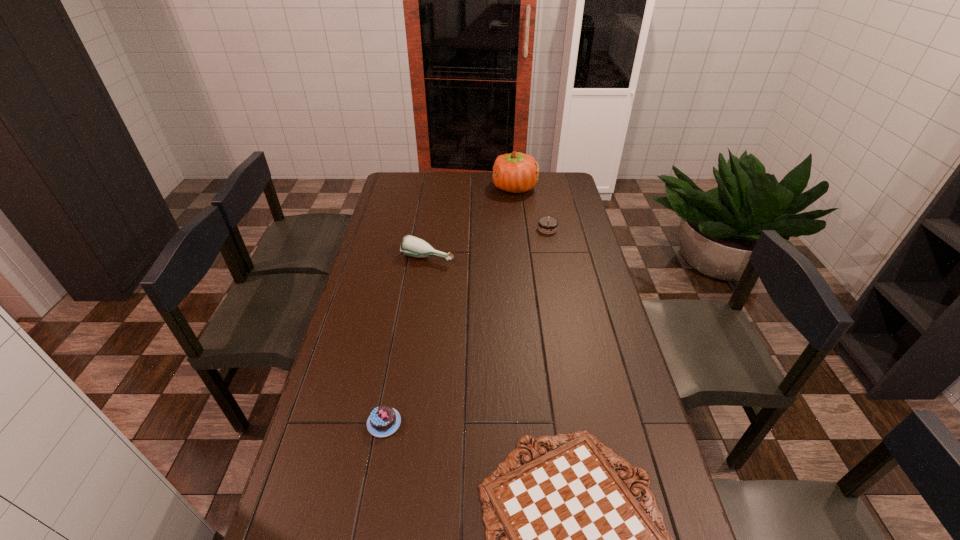
You are a GUI agent. You are given a task and a screenshot of the screen. Output one action in this format:
    pyautogui.click(x=<x>, y=<y>)
    Task: Click on the vacant space at the right edge
    This screenshot has width=960, height=540.
    Given the screenshot: What is the action you would take?
    pyautogui.click(x=565, y=253)

What are the coordinates of `vacant space at the far right corner of the desktop` in the screenshot? It's located at (558, 186).

At what (x,y) coordinates should I click in order to perform the action: click on free space between the fourth tallest object and the pumpkin. Please return your answer as a coordinate pair (x, y). The image size is (960, 540). Looking at the image, I should click on (449, 305).

Locate an element on the screen. free space that is in between the third tallest object and the fourth shortest object is located at coordinates (488, 243).

Find the location of a particular element. This screenshot has height=540, width=960. vacant point located between the bottle and the pumpkin is located at coordinates (471, 222).

Where is `free space between the third nearest object and the nearer chocolate cake`? The height and width of the screenshot is (540, 960). free space between the third nearest object and the nearer chocolate cake is located at coordinates (406, 340).

Image resolution: width=960 pixels, height=540 pixels. In order to click on object that is the third nearest to the chessboard in this screenshot , I will do `click(548, 225)`.

Find the location of `object that stands as the second closest to the second farthest object`. object that stands as the second closest to the second farthest object is located at coordinates (412, 246).

The image size is (960, 540). Find the location of `free space that satisfies the following two spatial constraints: 1. on the side of the tallest object with the cute face; 2. on the right side of the fourth nearest object`. free space that satisfies the following two spatial constraints: 1. on the side of the tallest object with the cute face; 2. on the right side of the fourth nearest object is located at coordinates (519, 229).

What are the coordinates of `vacant space that satisfies the following two spatial constraints: 1. on the side of the farthest object with the cute face; 2. on the right side of the right chocolate cake` in the screenshot? It's located at (519, 229).